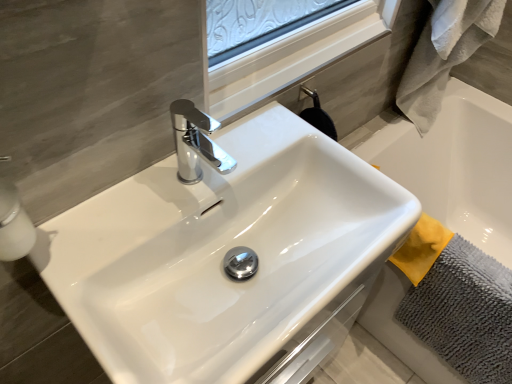
Question: Considering the relative sizes of white glossy soap dispenser at left and gray fluffy bath towel at right, acting as the first bath towel starting from the top, in the image provided, is white glossy soap dispenser at left thinner than gray fluffy bath towel at right, acting as the first bath towel starting from the top,?

Choices:
 (A) yes
 (B) no

Answer: (A)

Question: Is the depth of white glossy soap dispenser at left less than that of gray fluffy bath towel at right, which is the 2th bath towel from bottom to top?

Choices:
 (A) yes
 (B) no

Answer: (A)

Question: Is white glossy soap dispenser at left at the right side of gray fluffy bath towel at right, acting as the first bath towel starting from the top?

Choices:
 (A) no
 (B) yes

Answer: (A)

Question: Are white glossy soap dispenser at left and gray fluffy bath towel at right, acting as the first bath towel starting from the top, beside each other?

Choices:
 (A) no
 (B) yes

Answer: (A)

Question: Does white glossy soap dispenser at left have a larger size compared to gray fluffy bath towel at right, acting as the first bath towel starting from the top?

Choices:
 (A) no
 (B) yes

Answer: (A)

Question: Does white glossy soap dispenser at left have a greater height compared to gray fluffy bath towel at right, which is the 2th bath towel from bottom to top?

Choices:
 (A) yes
 (B) no

Answer: (B)

Question: From a real-world perspective, is white glossy soap dispenser at left positioned over gray microfiber bath towel at lower right, the 1th bath towel when ordered from bottom to top, based on gravity?

Choices:
 (A) no
 (B) yes

Answer: (B)

Question: Is gray microfiber bath towel at lower right, the 1th bath towel when ordered from bottom to top, inside white glossy soap dispenser at left?

Choices:
 (A) yes
 (B) no

Answer: (B)

Question: Is white glossy soap dispenser at left to the left of gray microfiber bath towel at lower right, the 1th bath towel when ordered from bottom to top, from the viewer's perspective?

Choices:
 (A) yes
 (B) no

Answer: (A)

Question: Is white glossy soap dispenser at left shorter than gray microfiber bath towel at lower right, the 1th bath towel when ordered from bottom to top?

Choices:
 (A) yes
 (B) no

Answer: (A)

Question: Is the depth of white glossy soap dispenser at left greater than that of gray microfiber bath towel at lower right, the 1th bath towel when ordered from bottom to top?

Choices:
 (A) yes
 (B) no

Answer: (B)

Question: Does white glossy soap dispenser at left have a lesser width compared to gray microfiber bath towel at lower right, the second bath towel in the top-to-bottom sequence?

Choices:
 (A) no
 (B) yes

Answer: (B)

Question: From a real-world perspective, is gray microfiber bath towel at lower right, the 1th bath towel when ordered from bottom to top, on gray fluffy bath towel at right, acting as the first bath towel starting from the top?

Choices:
 (A) yes
 (B) no

Answer: (B)